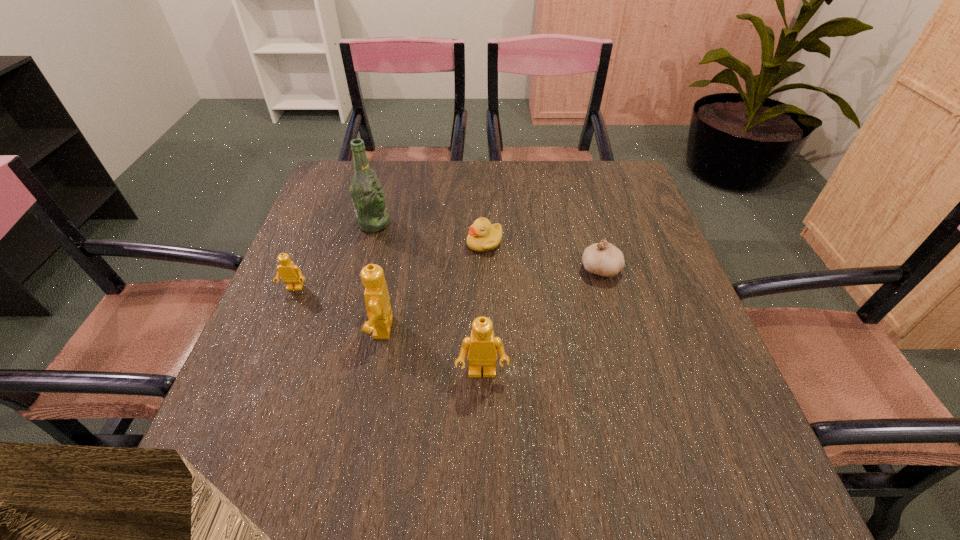
Where is `free space between the duckling and the nearest Lego`? free space between the duckling and the nearest Lego is located at coordinates (483, 308).

Identify the location of unoccupied area between the tallest object and the shortest object. (429, 233).

The width and height of the screenshot is (960, 540). I want to click on free spot between the duckling and the second tallest Lego, so click(x=483, y=308).

Where is `empty space between the shortest Lego and the rightmost object`? empty space between the shortest Lego and the rightmost object is located at coordinates (447, 279).

The height and width of the screenshot is (540, 960). I want to click on free spot between the second tallest Lego and the second nearest Lego, so click(431, 350).

Identify the location of free space between the rightmost object and the second shortest Lego. (541, 321).

What are the coordinates of `vacant point located between the rightmost Lego and the second Lego from left to right` in the screenshot? It's located at (431, 350).

The height and width of the screenshot is (540, 960). Find the location of `vacant area between the shortest object and the fourth object from right to left`. vacant area between the shortest object and the fourth object from right to left is located at coordinates (432, 285).

Identify the location of free spot between the beer bottle and the duckling. The image size is (960, 540). (429, 233).

What are the coordinates of `empty space that is in between the leftmost Lego and the second nearest object` in the screenshot? It's located at (338, 308).